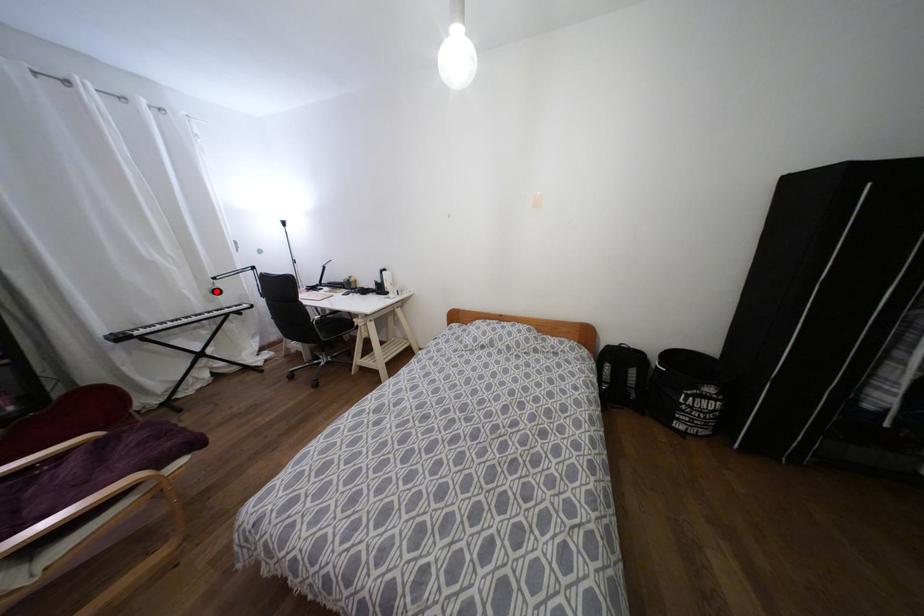
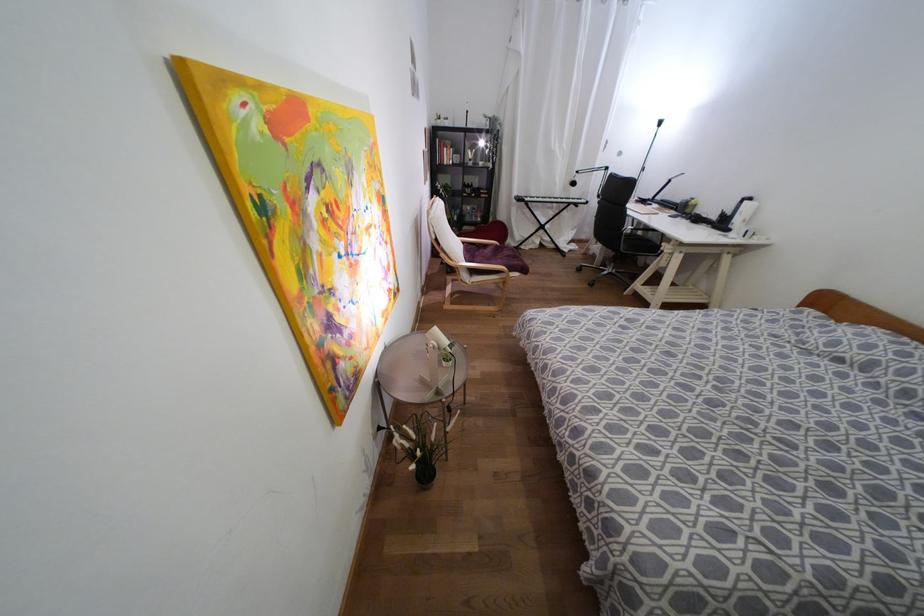
Question: I am providing you with two images of the same scene from different viewpoints. Given a red point in image1, look at the same physical point in image2. Is it:

Choices:
 (A) Closer to the viewpoint
 (B) Farther from the viewpoint

Answer: (A)